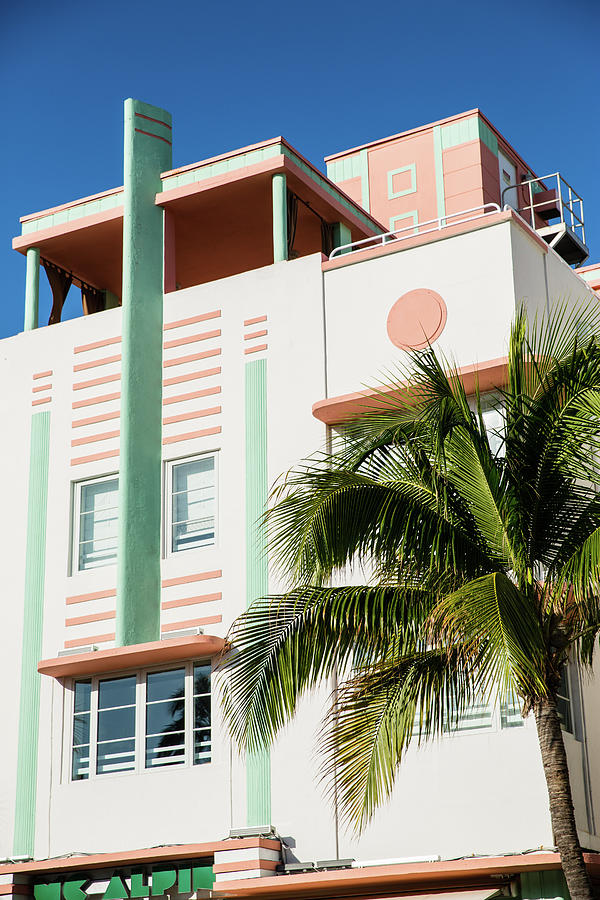
Where is `string of lights`? string of lights is located at coordinates (517, 851).